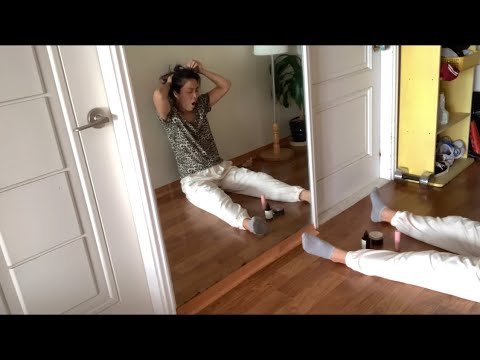
This screenshot has width=480, height=360. Identify the location of handle. (85, 125).